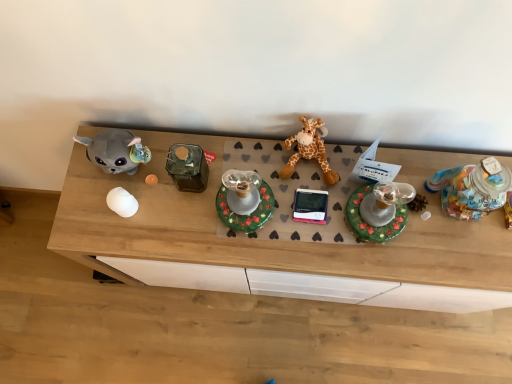
At what (x,y) coordinates should I click in order to perform the action: click on vacant space situated on the left part of shiny green plastic candle holder at center, which is the 3th toy from left to right. Please return your answer as a coordinate pair (x, y). The height and width of the screenshot is (384, 512). Looking at the image, I should click on (319, 230).